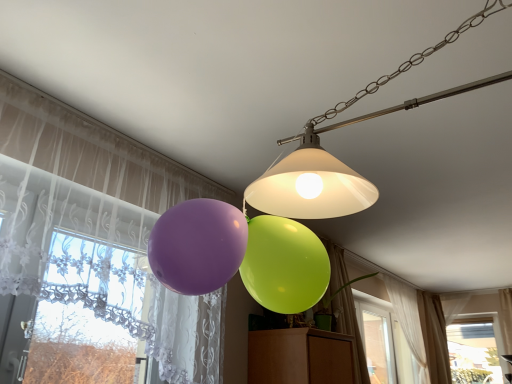
Question: Is beige sheer curtain at lower right, positioned as the fourth curtain in left-to-right order, taller than matte white lampshade at upper center?

Choices:
 (A) yes
 (B) no

Answer: (A)

Question: Can you confirm if beige sheer curtain at lower right, the 1th curtain viewed from the right, is bigger than matte white lampshade at upper center?

Choices:
 (A) yes
 (B) no

Answer: (B)

Question: Considering the relative sizes of beige sheer curtain at lower right, the 1th curtain viewed from the right, and matte white lampshade at upper center in the image provided, is beige sheer curtain at lower right, the 1th curtain viewed from the right, shorter than matte white lampshade at upper center?

Choices:
 (A) no
 (B) yes

Answer: (A)

Question: From the image's perspective, is beige sheer curtain at lower right, positioned as the first curtain in back-to-front order, over matte white lampshade at upper center?

Choices:
 (A) no
 (B) yes

Answer: (A)

Question: Is beige sheer curtain at lower right, the fourth curtain viewed from the front, beside matte white lampshade at upper center?

Choices:
 (A) no
 (B) yes

Answer: (A)

Question: Does beige sheer curtain at lower right, positioned as the first curtain in back-to-front order, have a smaller size compared to matte white lampshade at upper center?

Choices:
 (A) yes
 (B) no

Answer: (A)

Question: Is translucent fabric curtain at left, the 1th curtain from the front, closer to the viewer compared to beige sheer curtain at lower right, positioned as the fourth curtain in left-to-right order?

Choices:
 (A) no
 (B) yes

Answer: (B)

Question: Is beige sheer curtain at lower right, the fourth curtain viewed from the front, inside translucent fabric curtain at left, the 1th curtain from the front?

Choices:
 (A) yes
 (B) no

Answer: (B)

Question: Considering the relative sizes of translucent fabric curtain at left, the 4th curtain when ordered from back to front, and beige sheer curtain at lower right, positioned as the fourth curtain in left-to-right order, in the image provided, is translucent fabric curtain at left, the 4th curtain when ordered from back to front, thinner than beige sheer curtain at lower right, positioned as the fourth curtain in left-to-right order,?

Choices:
 (A) no
 (B) yes

Answer: (B)

Question: Considering the relative sizes of translucent fabric curtain at left, the 1th curtain from the left, and beige sheer curtain at lower right, positioned as the first curtain in back-to-front order, in the image provided, is translucent fabric curtain at left, the 1th curtain from the left, shorter than beige sheer curtain at lower right, positioned as the first curtain in back-to-front order,?

Choices:
 (A) yes
 (B) no

Answer: (A)

Question: Considering the relative sizes of translucent fabric curtain at left, the 1th curtain from the front, and beige sheer curtain at lower right, the 1th curtain viewed from the right, in the image provided, is translucent fabric curtain at left, the 1th curtain from the front, smaller than beige sheer curtain at lower right, the 1th curtain viewed from the right,?

Choices:
 (A) yes
 (B) no

Answer: (B)

Question: Does translucent fabric curtain at left, the 1th curtain from the front, appear on the right side of beige sheer curtain at lower right, the fourth curtain viewed from the front?

Choices:
 (A) yes
 (B) no

Answer: (B)

Question: Is green fabric curtain at lower right, acting as the 2th curtain starting from the left, not close to translucent fabric curtain at left, the 1th curtain from the left?

Choices:
 (A) no
 (B) yes

Answer: (B)